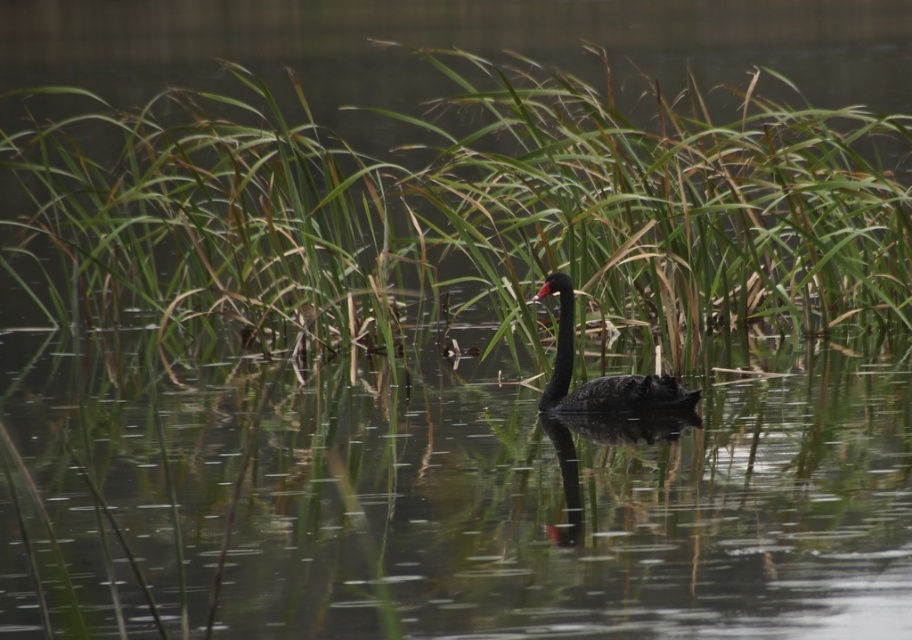
You are observing a serene natural scene with a black swan and tall grasses. You notice the green grass at center and the shiny black swan at center. Which object is positioned higher in the image?

The green grass at center is above the shiny black swan at center, so the green grass at center is positioned higher in the image.

You are standing at the point marked by the coordinates point (461, 212). Looking around, you see the black swan swimming in the water. Which direction should you walk to reach the black swan?

The point 0.334, 00507 is on green grass at center. The black swan is positioned slightly off center towards the right side of the frame. To reach the black swan, you should walk towards the right from the point (461, 212).